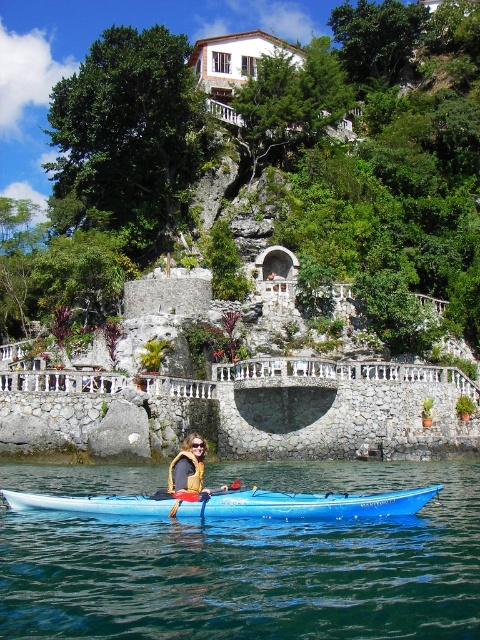
Question: Which object is positioned farthest from the blue rubber kayak at center?

Choices:
 (A) blue plastic paddle at center
 (B) yellow fabric life jacket at center
 (C) yellow life vest at center
 (D) blue plastic kayak at center

Answer: (B)

Question: Which of the following is the farthest from the observer?

Choices:
 (A) blue rubber kayak at center
 (B) yellow life vest at center
 (C) yellow fabric life jacket at center
 (D) blue plastic paddle at center

Answer: (C)

Question: Is blue rubber kayak at center wider than blue plastic paddle at center?

Choices:
 (A) yes
 (B) no

Answer: (A)

Question: Estimate the real-world distances between objects in this image. Which object is farther from the yellow fabric life jacket at center?

Choices:
 (A) blue plastic kayak at center
 (B) blue rubber kayak at center
 (C) yellow life vest at center

Answer: (B)

Question: Considering the relative positions of yellow life vest at center and blue plastic paddle at center in the image provided, where is yellow life vest at center located with respect to blue plastic paddle at center?

Choices:
 (A) left
 (B) right

Answer: (A)

Question: Is yellow fabric life jacket at center above blue plastic paddle at center?

Choices:
 (A) yes
 (B) no

Answer: (A)